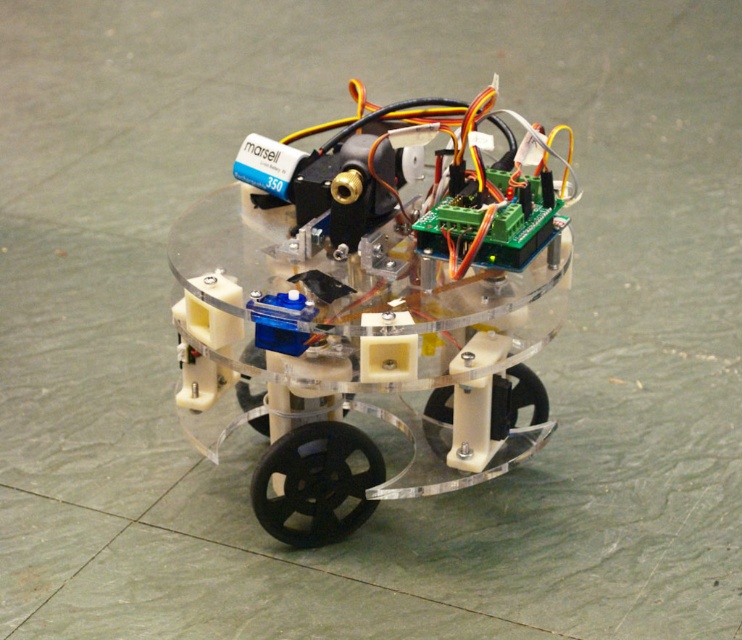
What is located at the point with coordinates (315,483) in the image?

The point with coordinates (315,483) corresponds to the black rubber wheel at center.

You are an engineer inspecting the robot. You need to replace a wheel that is too narrow for the terrain. Which wheel should you replace, the black rubber wheel at center or the black plastic wheel at lower center?

The black rubber wheel at center has a smaller width than the black plastic wheel at lower center, so you should replace the black rubber wheel at center.